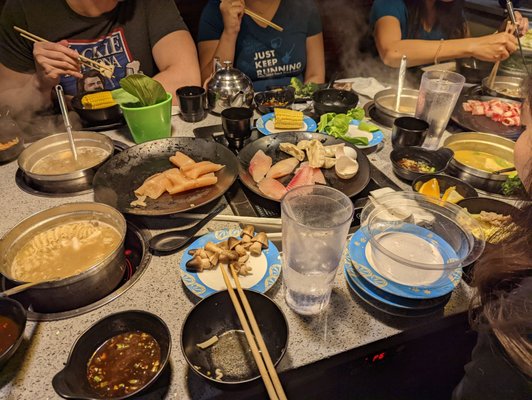
This screenshot has height=400, width=532. What are the coordinates of `table` in the screenshot? It's located at (329, 336).